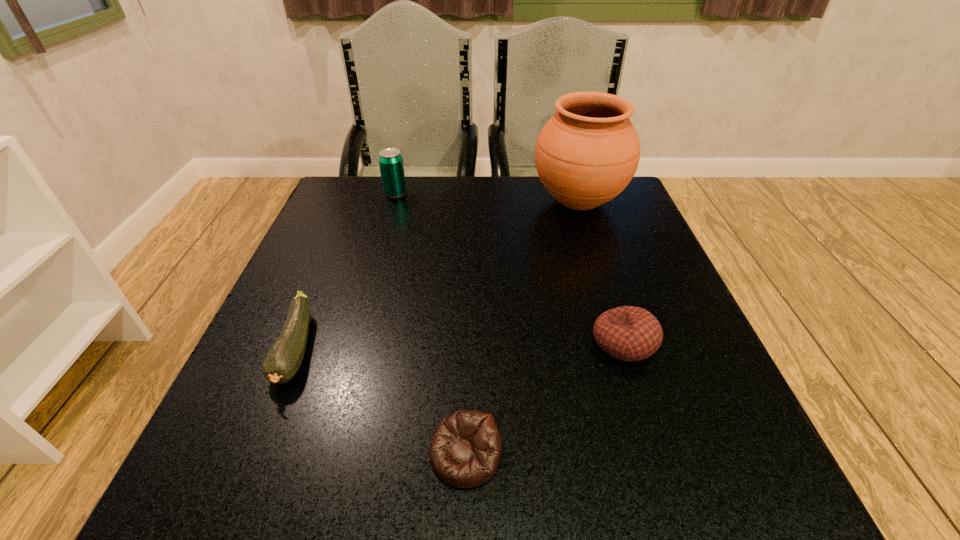
The width and height of the screenshot is (960, 540). Find the location of `free spot between the nearest object and the tallest object`. free spot between the nearest object and the tallest object is located at coordinates (522, 328).

You are a GUI agent. You are given a task and a screenshot of the screen. Output one action in this format:
    pyautogui.click(x=<x>, y=<y>)
    Task: Click on the free space between the fourth object from right to left and the shortest object
    
    Given the screenshot: What is the action you would take?
    pyautogui.click(x=430, y=324)

Image resolution: width=960 pixels, height=540 pixels. In order to click on unoccupied area between the pottery and the right beanbag in this screenshot , I will do `click(601, 272)`.

Where is `empty location between the fourth object from right to left and the taller beanbag`? Image resolution: width=960 pixels, height=540 pixels. empty location between the fourth object from right to left and the taller beanbag is located at coordinates (510, 268).

This screenshot has height=540, width=960. What are the coordinates of `vacant area that lies between the third shortest object and the second tallest object` in the screenshot? It's located at (510, 268).

The image size is (960, 540). I want to click on vacant area between the right beanbag and the tallest object, so click(x=601, y=272).

The height and width of the screenshot is (540, 960). What are the coordinates of `object that can be found as the second closest to the nearer beanbag` in the screenshot? It's located at (284, 359).

The width and height of the screenshot is (960, 540). Identify the location of the closest object relative to the beer can. (586, 154).

Locate an element on the screen. The height and width of the screenshot is (540, 960). vacant position in the image that satisfies the following two spatial constraints: 1. on the back side of the shorter beanbag; 2. on the right side of the tallest object is located at coordinates click(472, 201).

Find the location of `free space that satisfies the following two spatial constraints: 1. at the blossom end of the nearer beanbag; 2. on the right side of the leftmost object`. free space that satisfies the following two spatial constraints: 1. at the blossom end of the nearer beanbag; 2. on the right side of the leftmost object is located at coordinates (254, 454).